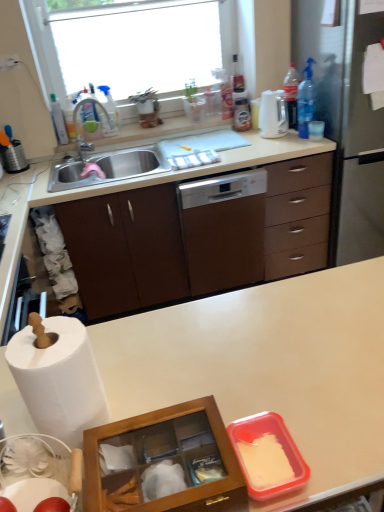
You are a GUI agent. You are given a task and a screenshot of the screen. Output one action in this format:
    pyautogui.click(x=<x>, y=<y>)
    Task: Click on the vacant area to the right of white paper at left
    Image resolution: width=384 pixels, height=512 pixels.
    Given the screenshot: What is the action you would take?
    pyautogui.click(x=180, y=380)